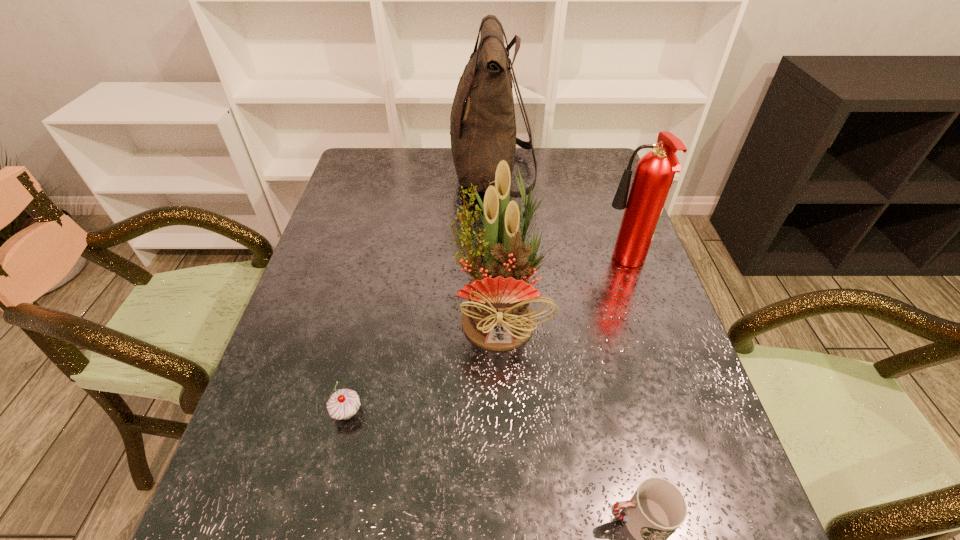
This screenshot has width=960, height=540. What are the coordinates of `the tallest object` in the screenshot? It's located at (482, 124).

The height and width of the screenshot is (540, 960). In order to click on backpack in this screenshot , I will do (482, 124).

Where is `flower arrangement`? Image resolution: width=960 pixels, height=540 pixels. flower arrangement is located at coordinates (498, 317).

This screenshot has width=960, height=540. In order to click on fire extinguisher in this screenshot , I will do `click(655, 171)`.

The height and width of the screenshot is (540, 960). In order to click on the fourth farthest object in this screenshot , I will do `click(344, 403)`.

Locate an element on the screen. The image size is (960, 540). cupcake is located at coordinates (344, 403).

Image resolution: width=960 pixels, height=540 pixels. Identify the location of free space located on the open flap of the tallest object. (360, 176).

At what (x,y) coordinates should I click in order to perform the action: click on free region located on the open flap of the tallest object. Please return your answer as a coordinate pair (x, y). Looking at the image, I should click on (357, 176).

Locate an element on the screen. free location located on the open flap of the tallest object is located at coordinates (357, 176).

Find the location of a particular element. The height and width of the screenshot is (540, 960). vacant space located in front of the flower arrangement with the fan visible is located at coordinates (507, 477).